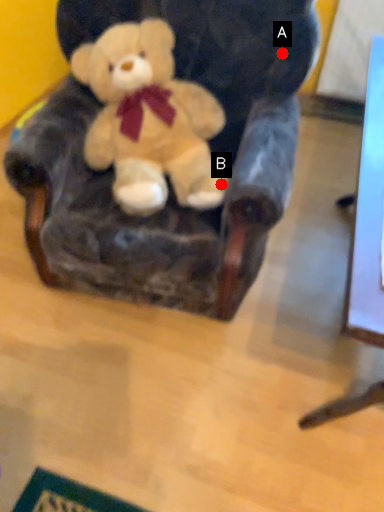
Question: Two points are circled on the image, labeled by A and B beside each circle. Which of the following is the closest to the observer?

Choices:
 (A) A is closer
 (B) B is closer

Answer: (B)